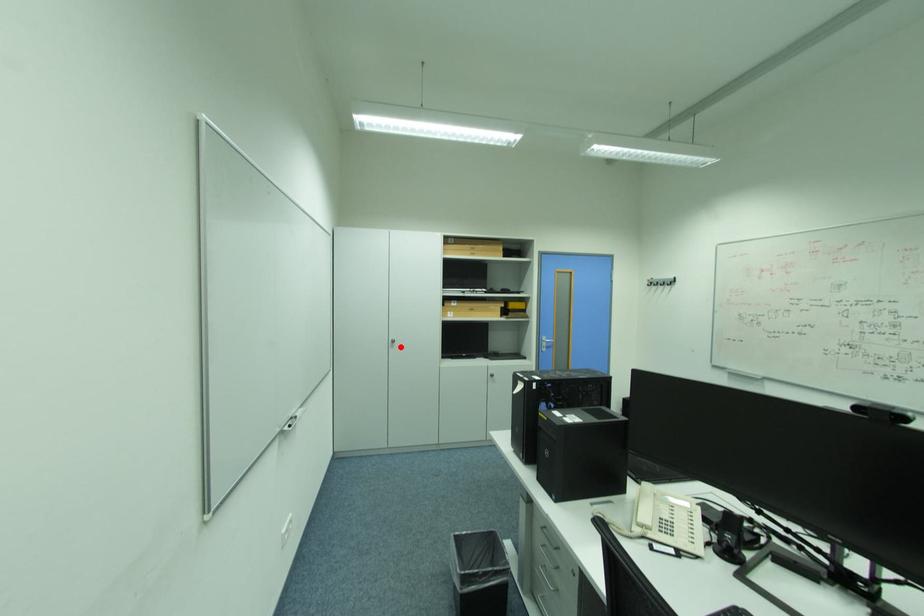
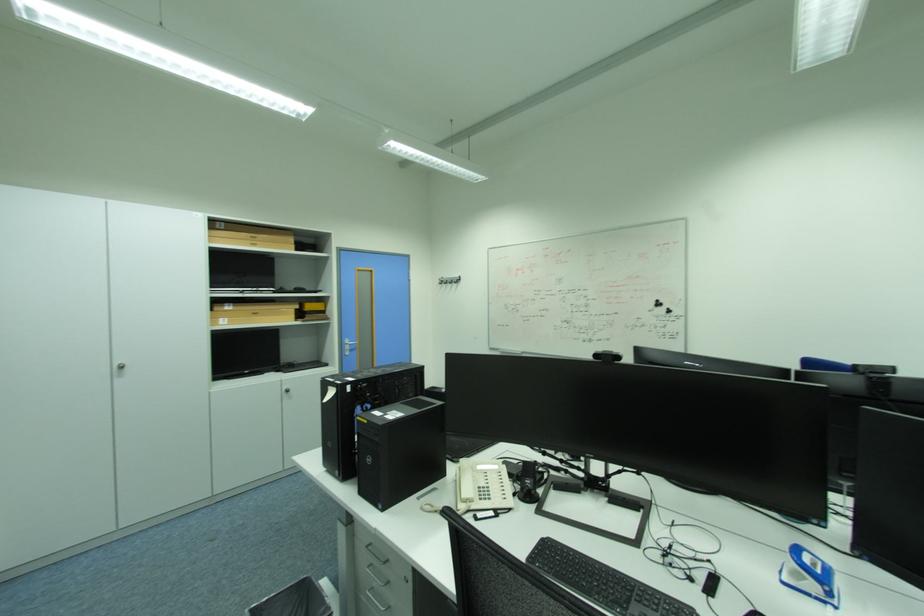
In the second image, find the point that corresponds to the highlighted location in the first image.

(128, 376)